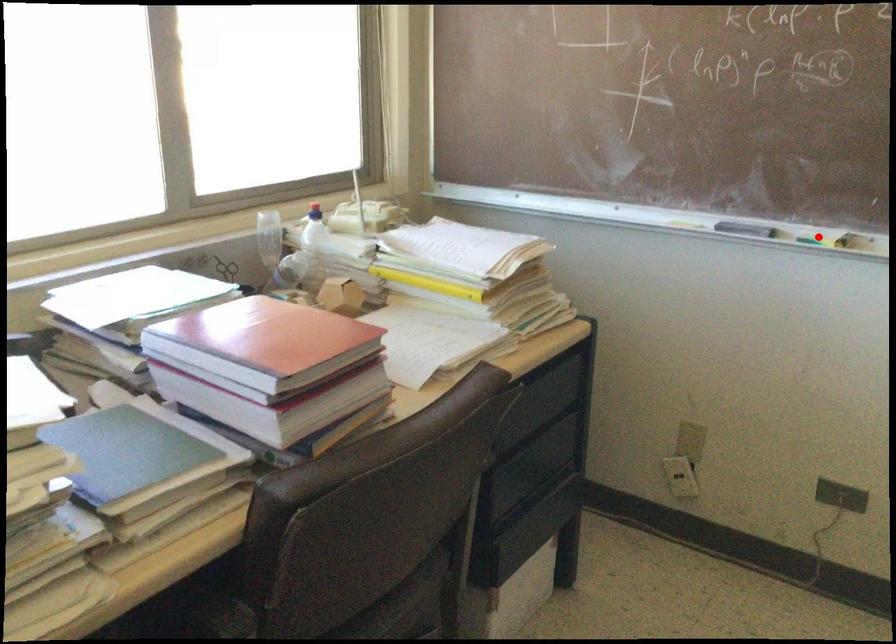
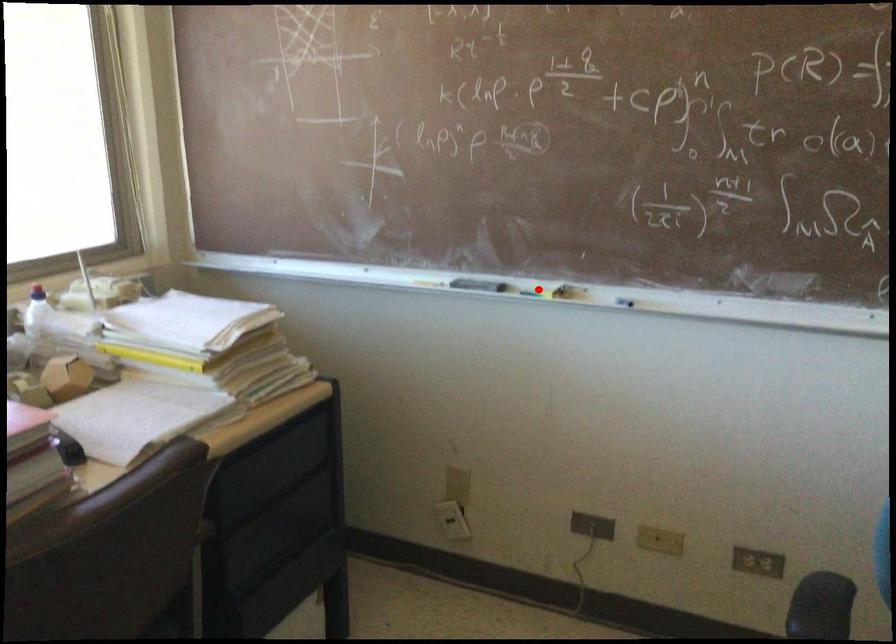
I am providing you with two images of the same scene from different viewpoints. A red point is marked on the first image and another point is marked on the second image. Do the highlighted points in image1 and image2 indicate the same real-world spot?

Yes